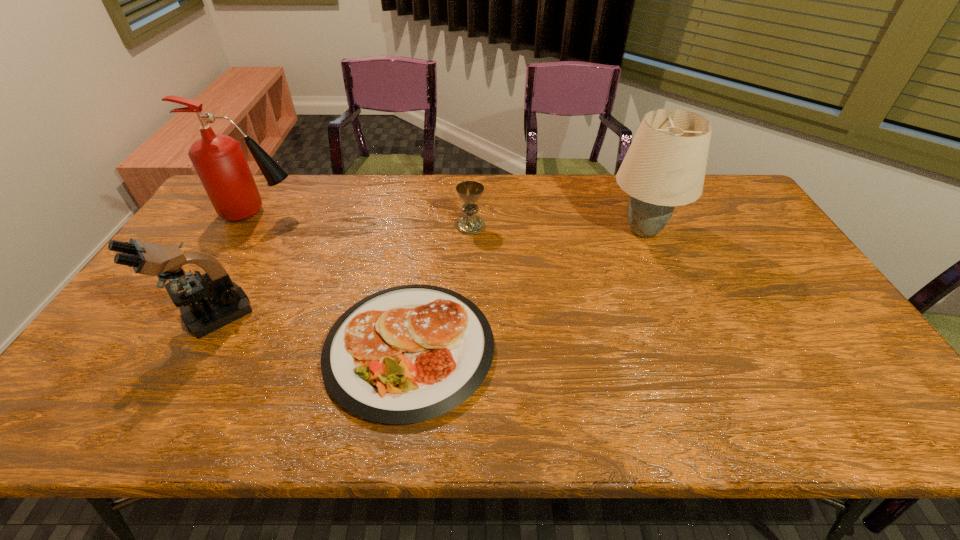
I want to click on fire extinguisher, so click(x=219, y=161).

Find the location of a particular element. The width and height of the screenshot is (960, 540). lampshade is located at coordinates (665, 165).

Locate an element on the screen. the third tallest object is located at coordinates (208, 303).

At what (x,y) coordinates should I click in order to perform the action: click on chalice. Please return your answer as a coordinate pair (x, y). Looking at the image, I should click on (469, 192).

Identify the location of dish. This screenshot has width=960, height=540. (407, 354).

Find the location of a particular element. The image size is (960, 540). vacant space located 0.320m with the nozzle aimed from the fire extinguisher is located at coordinates (396, 213).

I want to click on vacant area situated on the back of the rightmost object, so click(x=627, y=192).

Where is `free space located on the left of the microscope`? The image size is (960, 540). free space located on the left of the microscope is located at coordinates (149, 315).

You are a GUI agent. You are given a task and a screenshot of the screen. Output one action in this format:
    pyautogui.click(x=<x>, y=<y>)
    Task: Click on the free space located on the left of the fourth tallest object
    This screenshot has width=960, height=540.
    Given the screenshot: What is the action you would take?
    pyautogui.click(x=348, y=226)

At what (x,y) coordinates should I click in order to perform the action: click on free location located 0.290m on the back of the shortest object. Please return your answer as a coordinate pair (x, y). Looking at the image, I should click on (427, 225).